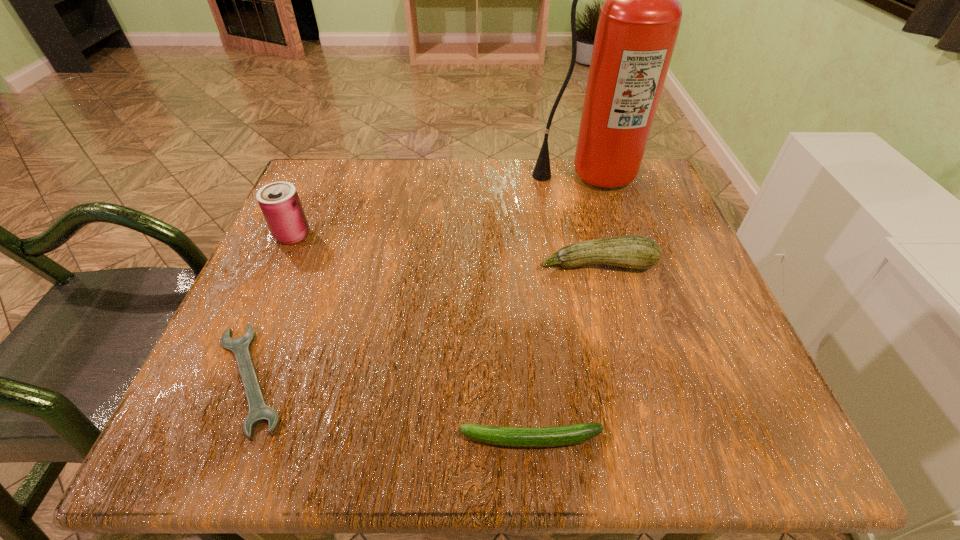
Identify the location of the farthest object. (639, 21).

What are the coordinates of `fire extinguisher` in the screenshot? It's located at (639, 21).

At what (x,y) coordinates should I click in order to perform the action: click on the second tallest object. Please return your answer as a coordinate pair (x, y). This screenshot has width=960, height=540. Looking at the image, I should click on (279, 202).

This screenshot has height=540, width=960. What are the coordinates of `can` in the screenshot? It's located at (279, 202).

Locate an element on the screen. the taller zucchini is located at coordinates (638, 252).

Where is `the farther zucchini`? The image size is (960, 540). the farther zucchini is located at coordinates (638, 252).

This screenshot has height=540, width=960. I want to click on the second shortest object, so click(x=554, y=436).

Identify the location of the nearer zucchini. coord(554,436).

Find the location of a particular element. the shortest object is located at coordinates (259, 412).

Find the location of a particular element. The image size is (960, 540). vacant region located 0.320m on the instruction side of the fire extinguisher is located at coordinates (626, 301).